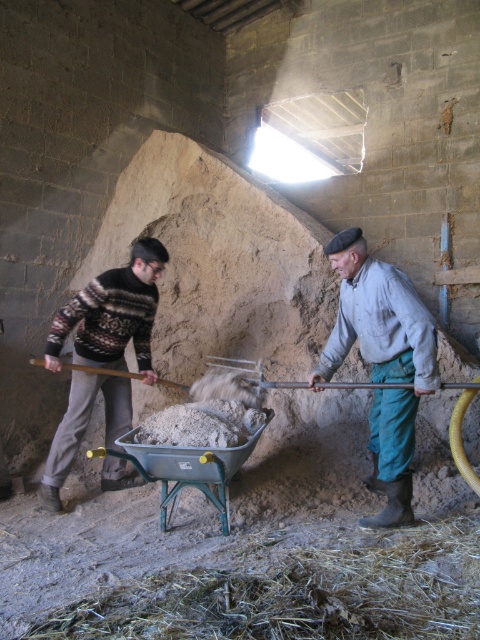
Question: Which point is farther to the camera?

Choices:
 (A) metal/grey wheelbarrow at center
 (B) wooden handle shovel at left

Answer: (B)

Question: Estimate the real-world distances between objects in this image. Which object is farther from the metal/grey wheelbarrow at center?

Choices:
 (A) brown straw at lower center
 (B) wooden handle shovel at left
 (C) gray cotton shirt at center
 (D) knitted sweater at left

Answer: (C)

Question: Does brown straw at lower center have a greater width compared to wooden handle shovel at left?

Choices:
 (A) no
 (B) yes

Answer: (B)

Question: Does knitted sweater at left appear on the right side of metal/grey wheelbarrow at center?

Choices:
 (A) yes
 (B) no

Answer: (B)

Question: Can you confirm if brown straw at lower center is wider than gray cotton shirt at center?

Choices:
 (A) yes
 (B) no

Answer: (A)

Question: Which of the following is the farthest from the observer?

Choices:
 (A) gray cotton shirt at center
 (B) wooden handle shovel at left
 (C) knitted sweater at left

Answer: (B)